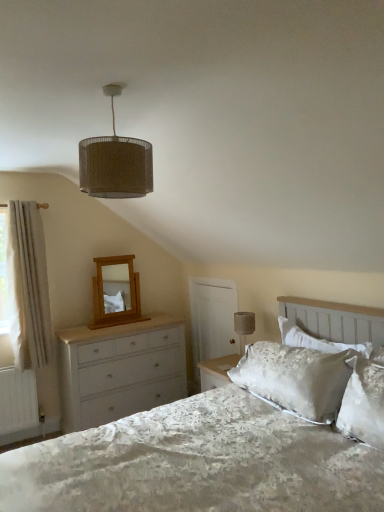
Question: Considering their positions, is light oak wooden mirror at upper left located in front of or behind matte gray fabric at upper right?

Choices:
 (A) front
 (B) behind

Answer: (B)

Question: Does point (120, 318) appear closer or farther from the camera than point (241, 333)?

Choices:
 (A) farther
 (B) closer

Answer: (A)

Question: Which object is the farthest from the white satin bed at center?

Choices:
 (A) matte gray fabric at upper right
 (B) burlap lampshade at upper center
 (C) white painted wood chest of drawers at left
 (D) white wooden screen door at center
 (E) light oak wooden mirror at upper left

Answer: (E)

Question: Considering the real-world distances, which object is closest to the white satin bed at center?

Choices:
 (A) light oak wooden mirror at upper left
 (B) burlap lampshade at upper center
 (C) silky white pillow at upper right
 (D) white wooden screen door at center
 (E) white fluffy curtain at left

Answer: (C)